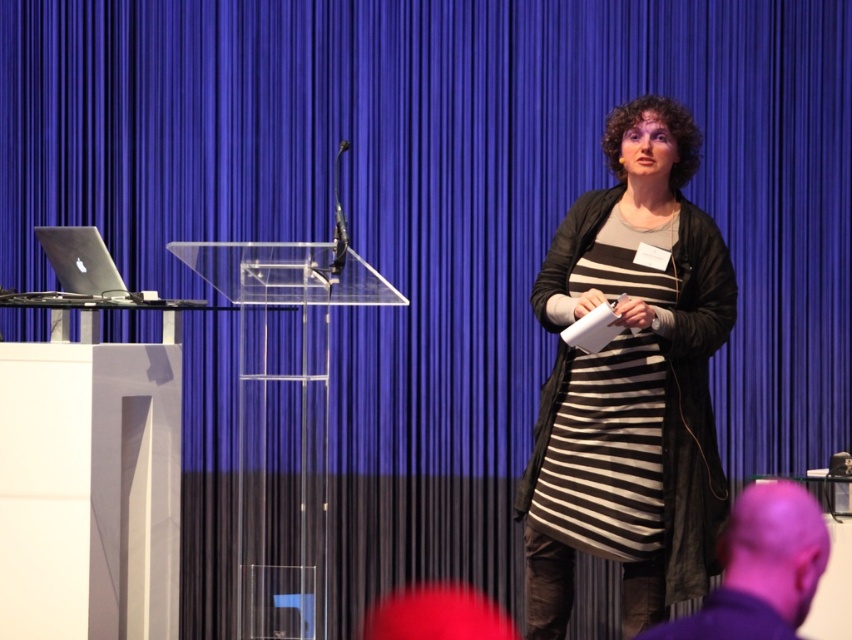
Question: In this image, where is purple hair at lower right located relative to silver metallic laptop at left?

Choices:
 (A) right
 (B) left

Answer: (A)

Question: Is purple hair at lower right positioned before silver metallic laptop at left?

Choices:
 (A) yes
 (B) no

Answer: (A)

Question: Can you confirm if striped fabric dress at center is thinner than purple hair at lower right?

Choices:
 (A) no
 (B) yes

Answer: (A)

Question: Which object is positioned farthest from the striped fabric dress at center?

Choices:
 (A) silver metallic laptop at left
 (B) purple hair at lower right

Answer: (A)

Question: Which of the following is the farthest from the observer?

Choices:
 (A) striped fabric dress at center
 (B) silver metallic laptop at left

Answer: (B)

Question: Which object is farther from the camera taking this photo?

Choices:
 (A) purple hair at lower right
 (B) silver metallic laptop at left
 (C) striped fabric dress at center

Answer: (B)